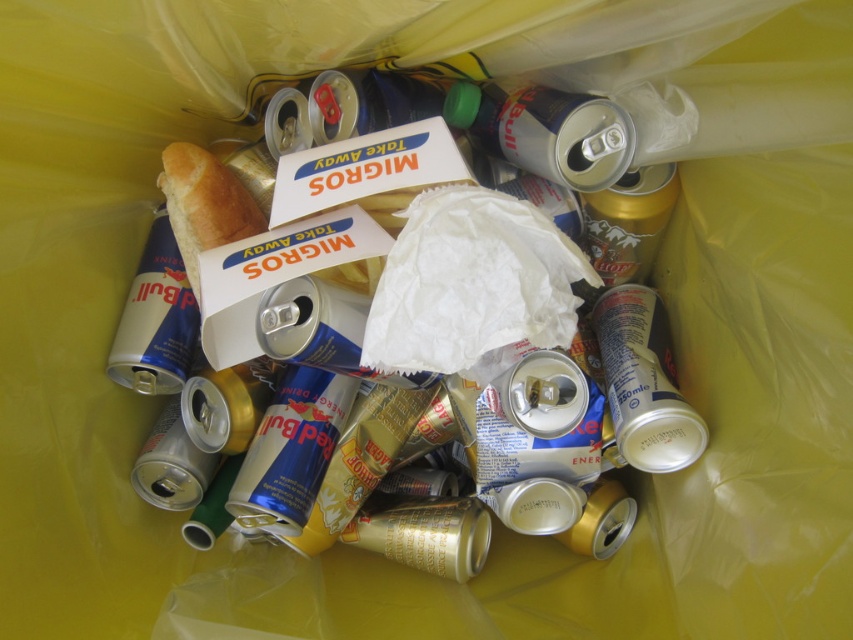
Between silver metallic can at center and blue metallic can at center-left, which one is positioned lower?

silver metallic can at center is lower down.

Can you confirm if silver metallic can at center is thinner than blue metallic can at center-left?

No, silver metallic can at center is not thinner than blue metallic can at center-left.

Identify the location of silver metallic can at center. This screenshot has width=853, height=640. (601, 525).

Which of these two, silver metallic can at center or silver metallic can at center-right, stands taller?

silver metallic can at center

Is silver metallic can at center to the right of silver metallic can at center-right from the viewer's perspective?

Incorrect, silver metallic can at center is not on the right side of silver metallic can at center-right.

Describe the element at coordinates (601, 525) in the screenshot. I see `silver metallic can at center` at that location.

Find the location of `silver metallic can at center`. silver metallic can at center is located at coordinates (601, 525).

Can you confirm if silver metallic can at center-right is positioned to the left of blue metallic can at center-left?

No, silver metallic can at center-right is not to the left of blue metallic can at center-left.

Can you confirm if silver metallic can at center-right is positioned above blue metallic can at center-left?

No.

This screenshot has width=853, height=640. Find the location of `silver metallic can at center-right`. silver metallic can at center-right is located at coordinates (643, 381).